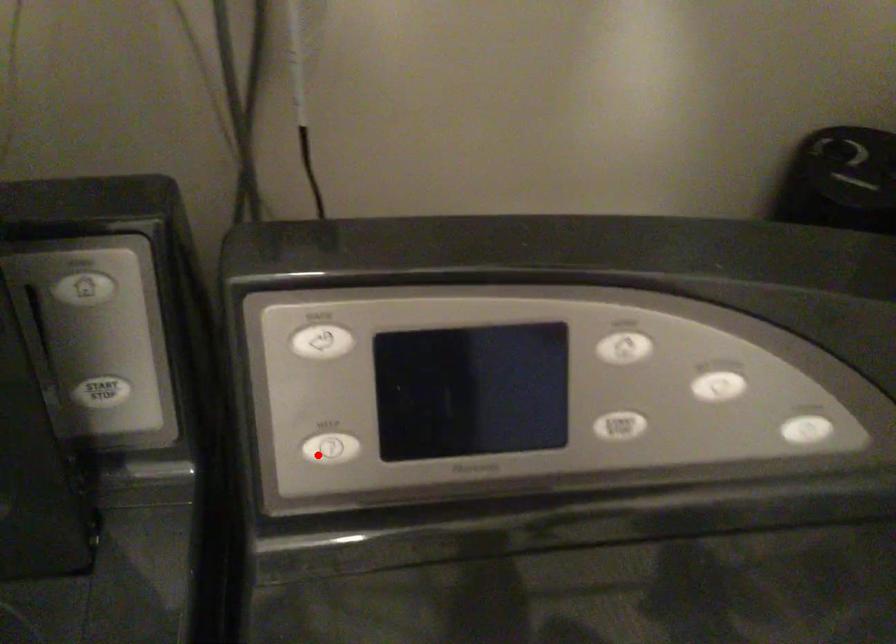
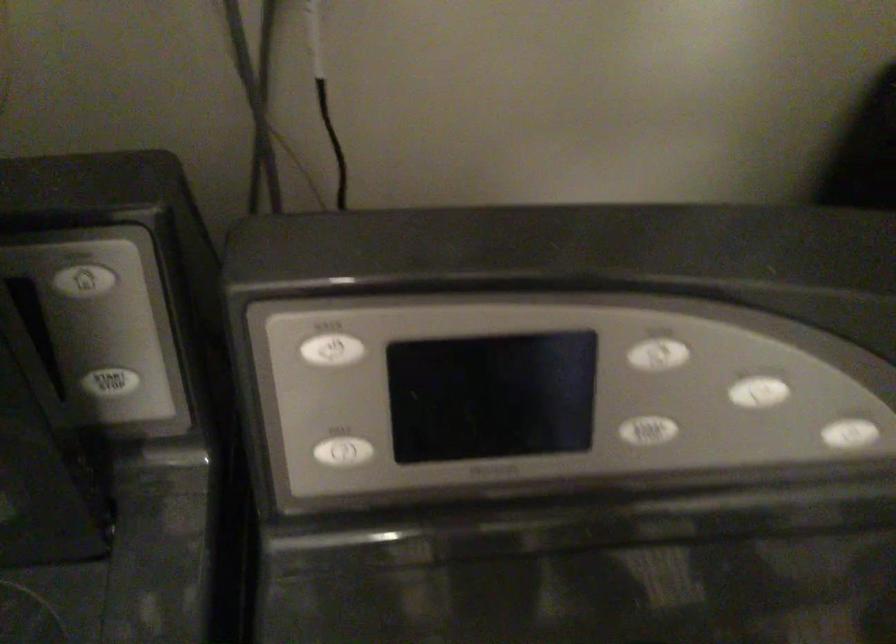
Locate, in the second image, the point that corresponds to the highlighted location in the first image.

(332, 458)